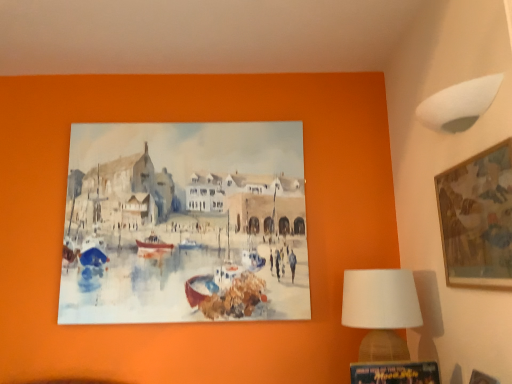
Question: Does white fabric lampshade at upper right turn towards white fabric lampshade at lower right?

Choices:
 (A) yes
 (B) no

Answer: (B)

Question: Can you confirm if white fabric lampshade at upper right is positioned to the right of white fabric lampshade at lower right?

Choices:
 (A) yes
 (B) no

Answer: (A)

Question: Is white fabric lampshade at lower right located within white fabric lampshade at upper right?

Choices:
 (A) yes
 (B) no

Answer: (B)

Question: Is white fabric lampshade at upper right further to camera compared to white fabric lampshade at lower right?

Choices:
 (A) yes
 (B) no

Answer: (B)

Question: From a real-world perspective, is white fabric lampshade at upper right physically below white fabric lampshade at lower right?

Choices:
 (A) no
 (B) yes

Answer: (A)

Question: In terms of width, does wooden picture frame at lower right, the 2th picture frame in the right-to-left sequence, look wider or thinner when compared to white fabric lampshade at lower right?

Choices:
 (A) wide
 (B) thin

Answer: (A)

Question: In the image, is wooden picture frame at lower right, which is the first picture frame from bottom to top, positioned in front of or behind white fabric lampshade at lower right?

Choices:
 (A) front
 (B) behind

Answer: (A)

Question: Is wooden picture frame at lower right, marked as the 1th picture frame in a left-to-right arrangement, bigger or smaller than white fabric lampshade at lower right?

Choices:
 (A) big
 (B) small

Answer: (B)

Question: From a real-world perspective, is wooden picture frame at lower right, marked as the 1th picture frame in a left-to-right arrangement, positioned above or below white fabric lampshade at lower right?

Choices:
 (A) above
 (B) below

Answer: (B)

Question: Considering the positions of white fabric lampshade at lower right and wooden picture frame at lower right, the second picture frame when ordered from top to bottom, in the image, is white fabric lampshade at lower right bigger or smaller than wooden picture frame at lower right, the second picture frame when ordered from top to bottom,?

Choices:
 (A) big
 (B) small

Answer: (A)

Question: From their relative heights in the image, would you say white fabric lampshade at lower right is taller or shorter than wooden picture frame at lower right, marked as the 1th picture frame in a left-to-right arrangement?

Choices:
 (A) tall
 (B) short

Answer: (A)

Question: From a real-world perspective, relative to wooden picture frame at lower right, the 2th picture frame in the right-to-left sequence, is white fabric lampshade at lower right vertically above or below?

Choices:
 (A) below
 (B) above

Answer: (B)

Question: Is point (345, 319) positioned closer to the camera than point (435, 365)?

Choices:
 (A) closer
 (B) farther

Answer: (B)

Question: Considering their positions, is white fabric lampshade at lower right located in front of or behind wooden frame at upper right, the second picture frame ordered from the bottom?

Choices:
 (A) behind
 (B) front

Answer: (A)

Question: Is point 350,289 closer or farther from the camera than point 493,243?

Choices:
 (A) closer
 (B) farther

Answer: (B)